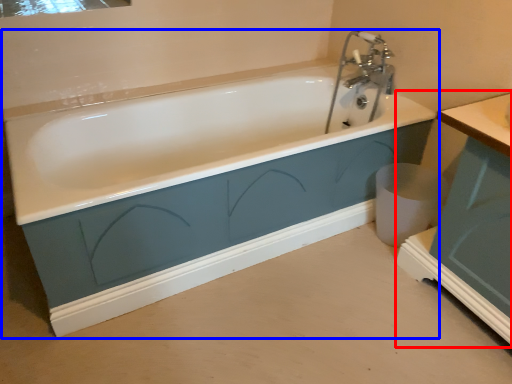
Question: Which object is closer to the camera taking this photo, vanity (highlighted by a red box) or bathtub (highlighted by a blue box)?

Choices:
 (A) vanity
 (B) bathtub

Answer: (A)